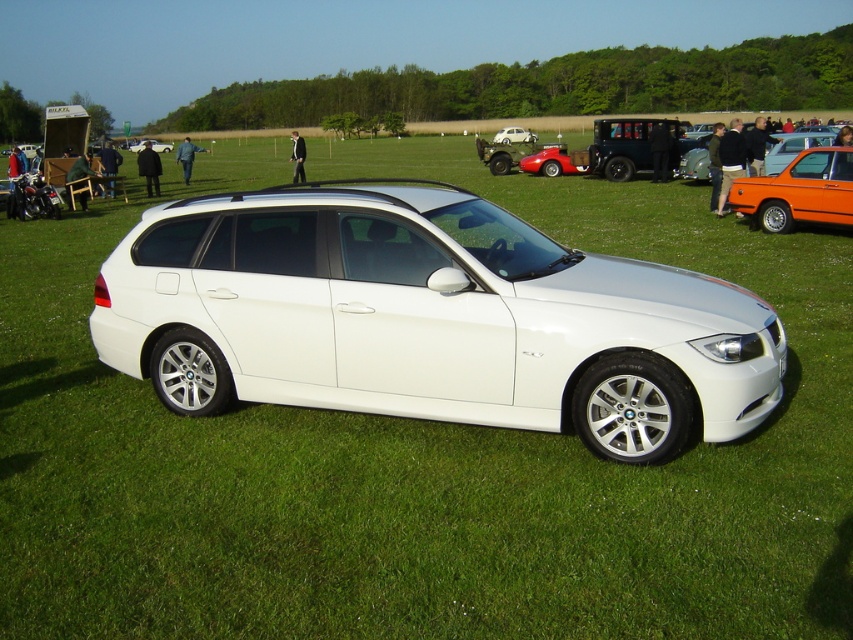
Can you confirm if metallic silver car at center is thinner than white matte hatchback at center?

Yes, metallic silver car at center is thinner than white matte hatchback at center.

Between metallic silver car at center and white matte hatchback at center, which one has less height?

white matte hatchback at center

Is point (531, 131) closer to camera compared to point (155, 148)?

No, it is not.

This screenshot has width=853, height=640. What are the coordinates of `metallic silver car at center` in the screenshot? It's located at (514, 134).

Between point (817, 134) and point (500, 140), which one is positioned in front?

Point (817, 134) is more forward.

You are a GUI agent. You are given a task and a screenshot of the screen. Output one action in this format:
    pyautogui.click(x=<x>, y=<y>)
    Task: Click on the metallic orange car at right
    
    Given the screenshot: What is the action you would take?
    point(792,148)

This screenshot has width=853, height=640. Describe the element at coordinates (792, 148) in the screenshot. I see `metallic orange car at right` at that location.

Which is below, metallic orange car at right or white matte hatchback at center?

Positioned lower is metallic orange car at right.

This screenshot has height=640, width=853. In order to click on metallic orange car at right in this screenshot , I will do `click(792, 148)`.